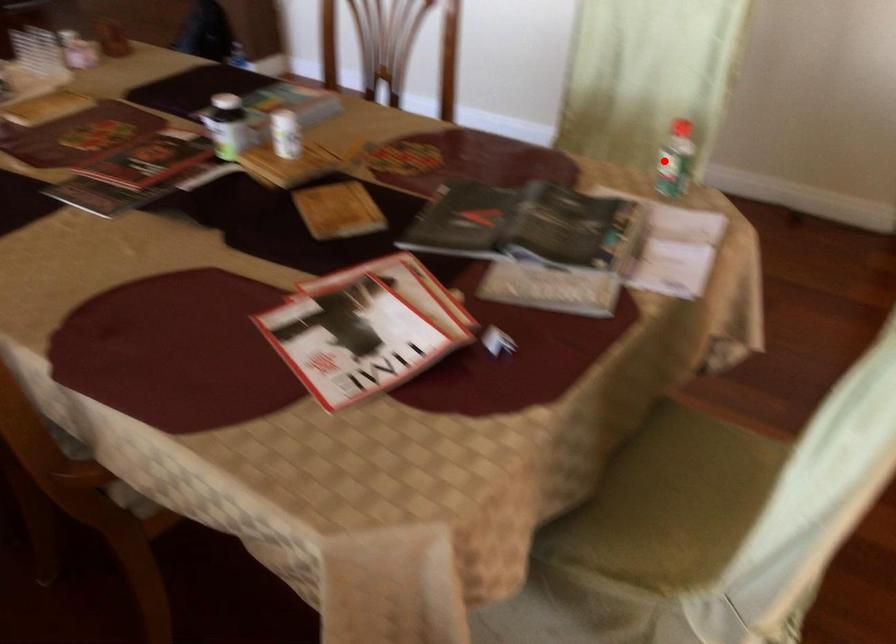
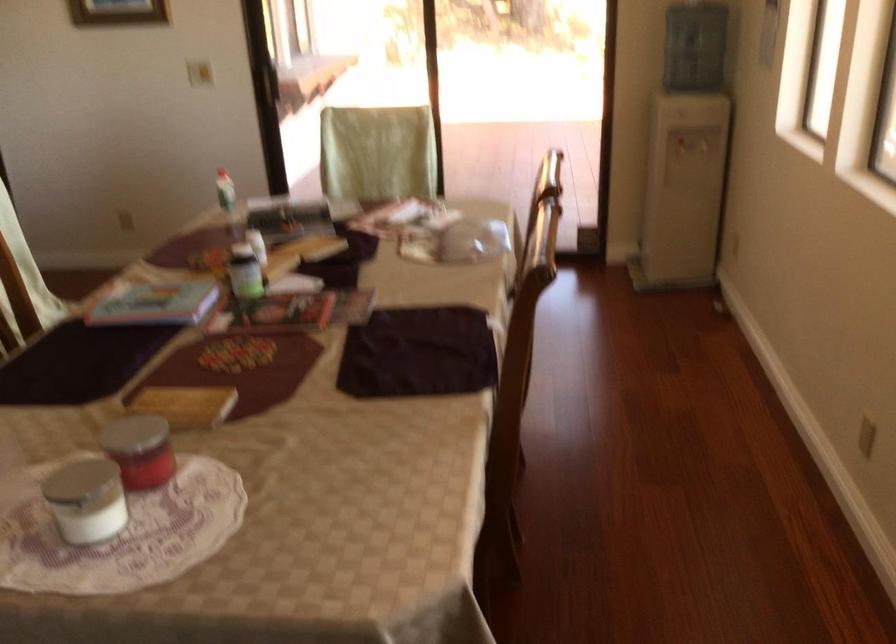
Question: A red point is marked in image1. In image2, is the corresponding 3D point closer to the camera or farther? Reply with the corresponding letter.

Choices:
 (A) The corresponding 3D point is closer.
 (B) The corresponding 3D point is farther.

Answer: (B)